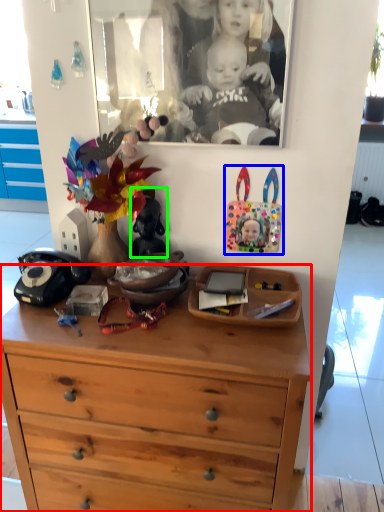
Question: Based on their relative distances, which object is nearer to chest of drawers (highlighted by a red box)? Choose from toy (highlighted by a blue box) and toy (highlighted by a green box).

Choices:
 (A) toy
 (B) toy

Answer: (B)